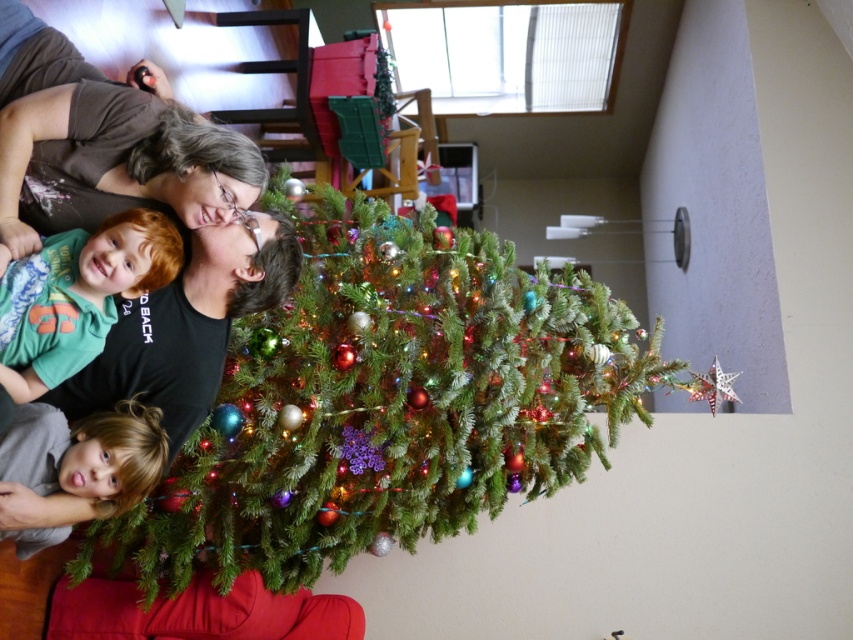
Question: Is green matte christmas tree at center below blonde hair at lower left?

Choices:
 (A) no
 (B) yes

Answer: (A)

Question: Which of the following is the farthest from the observer?

Choices:
 (A) blonde hair at lower left
 (B) green matte shirt at left

Answer: (A)

Question: Can you confirm if green matte shirt at left is positioned below blonde hair at lower left?

Choices:
 (A) yes
 (B) no

Answer: (B)

Question: Which of the following is the farthest from the observer?

Choices:
 (A) green matte christmas tree at center
 (B) green matte shirt at left

Answer: (A)

Question: Based on their relative distances, which object is nearer to the green matte shirt at left?

Choices:
 (A) blonde hair at lower left
 (B) green matte christmas tree at center

Answer: (A)

Question: Does green matte christmas tree at center have a greater width compared to blonde hair at lower left?

Choices:
 (A) no
 (B) yes

Answer: (B)